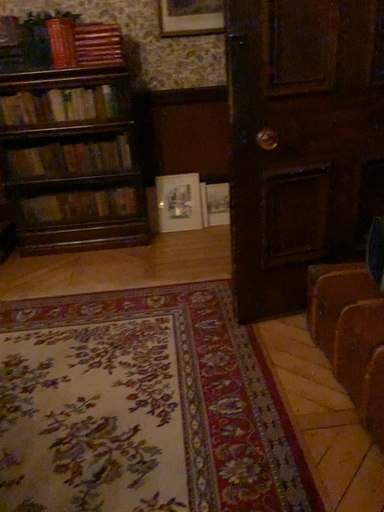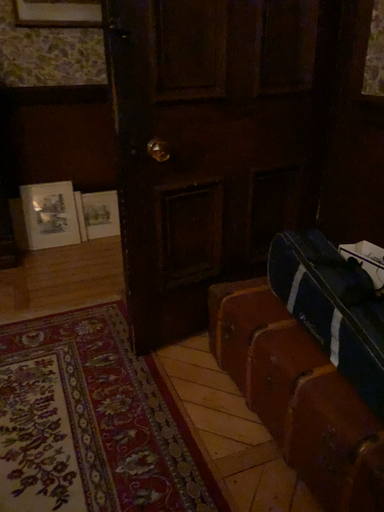
Question: How did the camera likely rotate when shooting the video?

Choices:
 (A) rotated right
 (B) rotated left

Answer: (A)